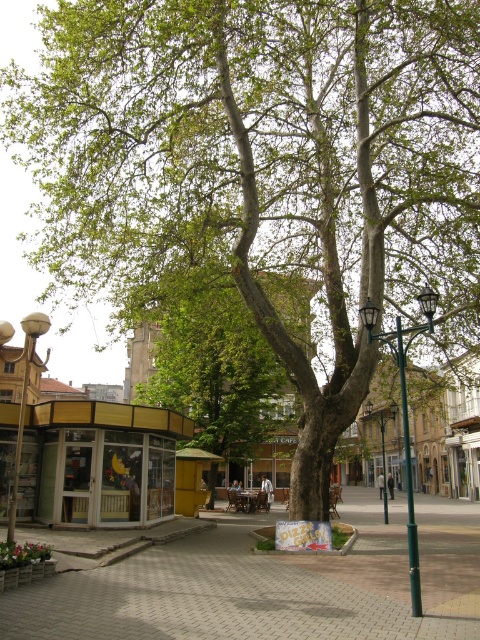
Is the position of green leafy tree at center less distant than that of green metal streetlight at center?

Yes, it is in front of green metal streetlight at center.

Can you confirm if green leafy tree at center is smaller than green metal streetlight at center?

Actually, green leafy tree at center might be larger than green metal streetlight at center.

The image size is (480, 640). What do you see at coordinates (213, 364) in the screenshot?
I see `green leafy tree at center` at bounding box center [213, 364].

This screenshot has height=640, width=480. I want to click on green leafy tree at center, so click(x=213, y=364).

Who is more forward, (x=26, y=593) or (x=377, y=412)?

Point (x=26, y=593)

Is paved brick pavement at center taller than green metal streetlight at center?

Result: No, paved brick pavement at center is not taller than green metal streetlight at center.

In order to click on paved brick pavement at center in this screenshot , I will do `click(247, 595)`.

Which is in front, point (417, 550) or point (44, 365)?

Point (417, 550) is in front.

Consider the image. Is green metal/glass streetlamp at center-right below matte white lamp post at left?

No, green metal/glass streetlamp at center-right is not below matte white lamp post at left.

Does point (419, 568) come in front of point (36, 314)?

Yes, it is.

This screenshot has width=480, height=640. In order to click on green metal/glass streetlamp at center-right in this screenshot , I will do pos(405,413).